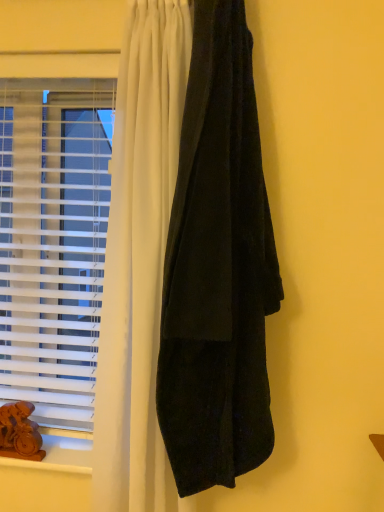
What do you see at coordinates (19, 432) in the screenshot? The image size is (384, 512). I see `brown wooden animal at lower left` at bounding box center [19, 432].

Locate an element on the screen. wooden at lower left is located at coordinates (60, 452).

This screenshot has width=384, height=512. What are the coordinates of `velvet black curtain at right` in the screenshot? It's located at (218, 268).

From a real-world perspective, who is located lower, brown wooden animal at lower left or velvet black curtain at right?

brown wooden animal at lower left.

Is brown wooden animal at lower left to the left of velvet black curtain at right from the viewer's perspective?

Indeed, brown wooden animal at lower left is positioned on the left side of velvet black curtain at right.

From the image's perspective, is brown wooden animal at lower left located above or below velvet black curtain at right?

brown wooden animal at lower left is situated lower than velvet black curtain at right in the image.

Is brown wooden animal at lower left facing away from velvet black curtain at right?

No, brown wooden animal at lower left is not facing the opposite direction of velvet black curtain at right.

Which is behind, point (44, 297) or point (29, 467)?

The point (44, 297) is more distant.

The height and width of the screenshot is (512, 384). In order to click on window sill below the white plastic blinds at left (from the image's perspective) in this screenshot , I will do `click(60, 452)`.

How many degrees apart are the facing directions of white plastic blinds at left and wooden at lower left?

white plastic blinds at left and wooden at lower left are facing 0.00125 degrees away from each other.

Consider the image. Does wooden at lower left have a greater height compared to velvet black curtain at right?

Incorrect, the height of wooden at lower left is not larger of that of velvet black curtain at right.

From the image's perspective, which is above, wooden at lower left or velvet black curtain at right?

From the image's view, velvet black curtain at right is above.

Considering the relative positions of wooden at lower left and velvet black curtain at right in the image provided, is wooden at lower left behind velvet black curtain at right?

Yes, the depth of wooden at lower left is greater than that of velvet black curtain at right.

Looking at this image, is wooden at lower left positioned in front of white plastic blinds at left?

No, wooden at lower left is behind white plastic blinds at left.

Looking at this image, which of these two, wooden at lower left or white plastic blinds at left, stands taller?

With more height is white plastic blinds at left.

Considering the sizes of objects wooden at lower left and white plastic blinds at left in the image provided, who is bigger, wooden at lower left or white plastic blinds at left?

white plastic blinds at left is bigger.

Which object is thinner, wooden at lower left or white plastic blinds at left?

With smaller width is white plastic blinds at left.

Considering the relative positions of brown wooden animal at lower left and wooden at lower left in the image provided, is brown wooden animal at lower left to the right of wooden at lower left from the viewer's perspective?

No, brown wooden animal at lower left is not to the right of wooden at lower left.

I want to click on animal that is above the wooden at lower left (from the image's perspective), so click(19, 432).

Is brown wooden animal at lower left far away from wooden at lower left?

Actually, brown wooden animal at lower left and wooden at lower left are a little close together.

How different are the orientations of brown wooden animal at lower left and wooden at lower left in degrees?

1.59 degrees.

Is point (194, 383) closer or farther from the camera than point (69, 144)?

Clearly, point (194, 383) is closer to the camera than point (69, 144).

In terms of width, does velvet black curtain at right look wider or thinner when compared to white plastic blinds at left?

velvet black curtain at right is wider than white plastic blinds at left.

Are velvet black curtain at right and white plastic blinds at left far apart?

No, velvet black curtain at right is not far away from white plastic blinds at left.

Which object is closer to the camera taking this photo, velvet black curtain at right or white plastic blinds at left?

velvet black curtain at right.

Between velvet black curtain at right and brown wooden animal at lower left, which one is positioned behind?

brown wooden animal at lower left is further from the camera.

Is the surface of velvet black curtain at right in direct contact with brown wooden animal at lower left?

velvet black curtain at right and brown wooden animal at lower left are not in contact.

Is velvet black curtain at right situated inside brown wooden animal at lower left or outside?

velvet black curtain at right cannot be found inside brown wooden animal at lower left.

Locate an element on the screen. The height and width of the screenshot is (512, 384). curtain on the right of brown wooden animal at lower left is located at coordinates (218, 268).

Find the location of `window in front of the wooden at lower left`. window in front of the wooden at lower left is located at coordinates (53, 242).

From the image, which object appears to be nearer to white plastic blinds at left, velvet black curtain at right or brown wooden animal at lower left?

brown wooden animal at lower left is closer to white plastic blinds at left.

Considering their positions, is velvet black curtain at right positioned closer to wooden at lower left than white plastic blinds at left?

Based on the image, white plastic blinds at left appears to be nearer to wooden at lower left.

When comparing their distances from white plastic blinds at left, does brown wooden animal at lower left or velvet black curtain at right seem further?

velvet black curtain at right lies further to white plastic blinds at left than the other object.

When comparing their distances from wooden at lower left, does white plastic blinds at left or velvet black curtain at right seem closer?

The object closer to wooden at lower left is white plastic blinds at left.

When comparing their distances from velvet black curtain at right, does white plastic blinds at left or brown wooden animal at lower left seem further?

brown wooden animal at lower left lies further to velvet black curtain at right than the other object.

Estimate the real-world distances between objects in this image. Which object is further from brown wooden animal at lower left, wooden at lower left or white plastic blinds at left?

The object further to brown wooden animal at lower left is white plastic blinds at left.

When comparing their distances from wooden at lower left, does brown wooden animal at lower left or white plastic blinds at left seem closer?

brown wooden animal at lower left lies closer to wooden at lower left than the other object.

When comparing their distances from velvet black curtain at right, does white plastic blinds at left or wooden at lower left seem closer?

white plastic blinds at left lies closer to velvet black curtain at right than the other object.

You are a GUI agent. You are given a task and a screenshot of the screen. Output one action in this format:
    pyautogui.click(x=<x>, y=<y>)
    Task: Click on the window between velvet black curtain at right and wooden at lower left in the up-down direction
    This screenshot has height=512, width=384.
    Given the screenshot: What is the action you would take?
    pyautogui.click(x=53, y=242)

Image resolution: width=384 pixels, height=512 pixels. I want to click on window sill located between brown wooden animal at lower left and velvet black curtain at right in the left-right direction, so click(60, 452).

Where is `window situated between brown wooden animal at lower left and velvet black curtain at right from left to right`? Image resolution: width=384 pixels, height=512 pixels. window situated between brown wooden animal at lower left and velvet black curtain at right from left to right is located at coordinates (53, 242).

Where is `animal between white plastic blinds at left and wooden at lower left in the up-down direction`? This screenshot has height=512, width=384. animal between white plastic blinds at left and wooden at lower left in the up-down direction is located at coordinates (19, 432).